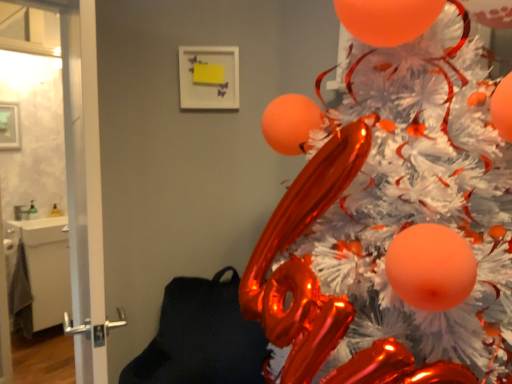
Question: Considering the relative positions of white glossy door at left, positioned as the 1th screen door in left-to-right order, and shiny metallic christmas tree at upper right in the image provided, is white glossy door at left, positioned as the 1th screen door in left-to-right order, in front of shiny metallic christmas tree at upper right?

Choices:
 (A) no
 (B) yes

Answer: (A)

Question: Is white glossy door at left, marked as the 2th screen door in a right-to-left arrangement, shorter than shiny metallic christmas tree at upper right?

Choices:
 (A) yes
 (B) no

Answer: (B)

Question: From a real-world perspective, is white glossy door at left, positioned as the 1th screen door in left-to-right order, on shiny metallic christmas tree at upper right?

Choices:
 (A) no
 (B) yes

Answer: (B)

Question: Can you confirm if white glossy door at left, positioned as the 1th screen door in left-to-right order, is thinner than shiny metallic christmas tree at upper right?

Choices:
 (A) yes
 (B) no

Answer: (A)

Question: Is white glossy door at left, marked as the 2th screen door in a right-to-left arrangement, oriented away from shiny metallic christmas tree at upper right?

Choices:
 (A) yes
 (B) no

Answer: (B)

Question: From the image's perspective, is white glossy door at left, positioned as the 1th screen door in left-to-right order, on shiny metallic christmas tree at upper right?

Choices:
 (A) no
 (B) yes

Answer: (B)

Question: Does shiny metallic christmas tree at upper right turn towards transparent glass door at left, which is counted as the 2th screen door, starting from the left?

Choices:
 (A) yes
 (B) no

Answer: (B)

Question: Would you say transparent glass door at left, placed as the first screen door when sorted from right to left, is part of shiny metallic christmas tree at upper right's contents?

Choices:
 (A) yes
 (B) no

Answer: (B)

Question: From the image's perspective, is shiny metallic christmas tree at upper right below transparent glass door at left, which is counted as the 2th screen door, starting from the left?

Choices:
 (A) no
 (B) yes

Answer: (B)

Question: Can you confirm if shiny metallic christmas tree at upper right is shorter than transparent glass door at left, which is counted as the 2th screen door, starting from the left?

Choices:
 (A) yes
 (B) no

Answer: (A)

Question: Is shiny metallic christmas tree at upper right bigger than transparent glass door at left, placed as the first screen door when sorted from right to left?

Choices:
 (A) yes
 (B) no

Answer: (A)

Question: Is shiny metallic christmas tree at upper right in contact with transparent glass door at left, placed as the first screen door when sorted from right to left?

Choices:
 (A) no
 (B) yes

Answer: (A)

Question: Considering the relative positions of white glossy door at left, marked as the 2th screen door in a right-to-left arrangement, and transparent glass door at left, which is counted as the 2th screen door, starting from the left, in the image provided, is white glossy door at left, marked as the 2th screen door in a right-to-left arrangement, behind transparent glass door at left, which is counted as the 2th screen door, starting from the left,?

Choices:
 (A) no
 (B) yes

Answer: (B)